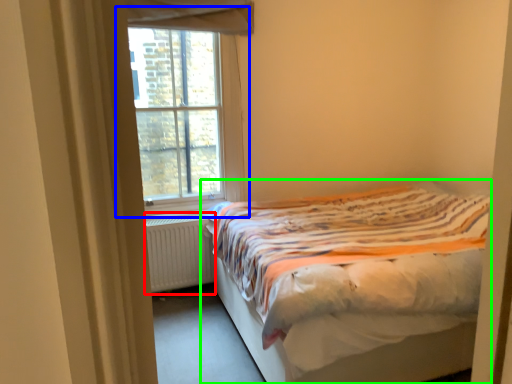
Question: Based on their relative distances, which object is nearer to radiator (highlighted by a red box)? Choose from window (highlighted by a blue box) and bed (highlighted by a green box).

Choices:
 (A) window
 (B) bed

Answer: (A)